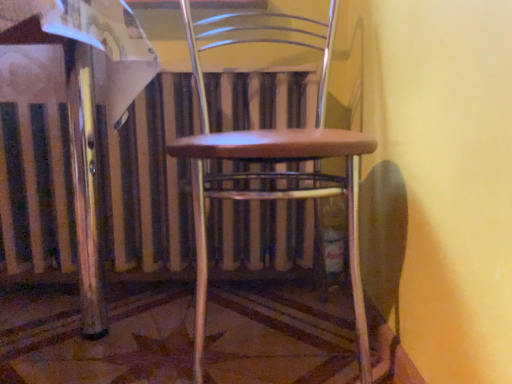
Question: Is point (202, 355) positioned closer to the camera than point (4, 244)?

Choices:
 (A) farther
 (B) closer

Answer: (B)

Question: Considering the positions of wooden seat at center and metallic silver radiator at center in the image, is wooden seat at center wider or thinner than metallic silver radiator at center?

Choices:
 (A) thin
 (B) wide

Answer: (B)

Question: From the image's perspective, is wooden seat at center above or below metallic silver radiator at center?

Choices:
 (A) above
 (B) below

Answer: (A)

Question: Considering the positions of point (60, 185) and point (201, 324), is point (60, 185) closer or farther from the camera than point (201, 324)?

Choices:
 (A) farther
 (B) closer

Answer: (A)

Question: Is metallic silver radiator at center wider or thinner than wooden seat at center?

Choices:
 (A) wide
 (B) thin

Answer: (B)

Question: Based on their positions, is metallic silver radiator at center located to the left or right of wooden seat at center?

Choices:
 (A) right
 (B) left

Answer: (B)

Question: From a real-world perspective, is metallic silver radiator at center positioned above or below wooden seat at center?

Choices:
 (A) above
 (B) below

Answer: (B)